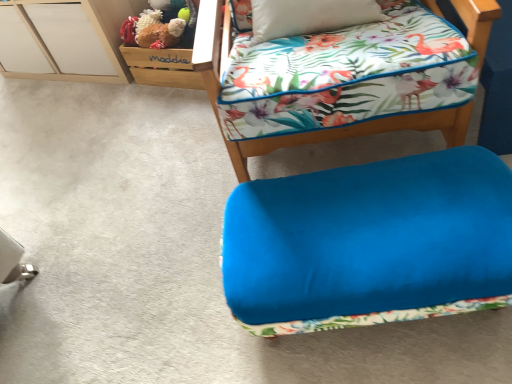
Question: Which direction should I rotate to look at velvet blue ottoman at lower center, which appears as the 2th furniture when ordered from the bottom?

Choices:
 (A) right
 (B) left

Answer: (A)

Question: Considering the relative positions of velvet blue ottoman at lower right, which appears as the first furniture when ordered from the bottom, and fluffy brown teddy bear at upper left in the image provided, is velvet blue ottoman at lower right, which appears as the first furniture when ordered from the bottom, in front of fluffy brown teddy bear at upper left?

Choices:
 (A) no
 (B) yes

Answer: (B)

Question: Is velvet blue ottoman at lower right, the 2th furniture viewed from the top, outside of fluffy brown teddy bear at upper left?

Choices:
 (A) no
 (B) yes

Answer: (B)

Question: Is velvet blue ottoman at lower right, which appears as the first furniture when ordered from the bottom, positioned far away from fluffy brown teddy bear at upper left?

Choices:
 (A) yes
 (B) no

Answer: (A)

Question: From a real-world perspective, does velvet blue ottoman at lower right, which appears as the first furniture when ordered from the bottom, stand above fluffy brown teddy bear at upper left?

Choices:
 (A) no
 (B) yes

Answer: (A)

Question: Would you say velvet blue ottoman at lower right, the 2th furniture viewed from the top, contains fluffy brown teddy bear at upper left?

Choices:
 (A) no
 (B) yes

Answer: (A)

Question: Is the depth of velvet blue ottoman at lower right, which appears as the first furniture when ordered from the bottom, greater than that of fluffy brown teddy bear at upper left?

Choices:
 (A) yes
 (B) no

Answer: (B)

Question: Would you say velvet blue ottoman at lower center, arranged as the 1th furniture when viewed from the top, is outside white matte file cabinet at upper left?

Choices:
 (A) no
 (B) yes

Answer: (B)

Question: Does velvet blue ottoman at lower center, arranged as the 1th furniture when viewed from the top, have a greater width compared to white matte file cabinet at upper left?

Choices:
 (A) no
 (B) yes

Answer: (B)

Question: Is the depth of velvet blue ottoman at lower center, arranged as the 1th furniture when viewed from the top, greater than that of white matte file cabinet at upper left?

Choices:
 (A) no
 (B) yes

Answer: (A)

Question: Is velvet blue ottoman at lower center, which appears as the 2th furniture when ordered from the bottom, to the left of white matte file cabinet at upper left from the viewer's perspective?

Choices:
 (A) no
 (B) yes

Answer: (A)

Question: Is white matte file cabinet at upper left completely or partially inside velvet blue ottoman at lower center, which appears as the 2th furniture when ordered from the bottom?

Choices:
 (A) no
 (B) yes

Answer: (A)

Question: From a real-world perspective, is velvet blue ottoman at lower center, which appears as the 2th furniture when ordered from the bottom, on top of white matte file cabinet at upper left?

Choices:
 (A) no
 (B) yes

Answer: (B)

Question: Considering the relative positions of velvet blue ottoman at lower center, arranged as the 1th furniture when viewed from the top, and fluffy brown teddy bear at upper left in the image provided, is velvet blue ottoman at lower center, arranged as the 1th furniture when viewed from the top, to the right of fluffy brown teddy bear at upper left from the viewer's perspective?

Choices:
 (A) yes
 (B) no

Answer: (A)